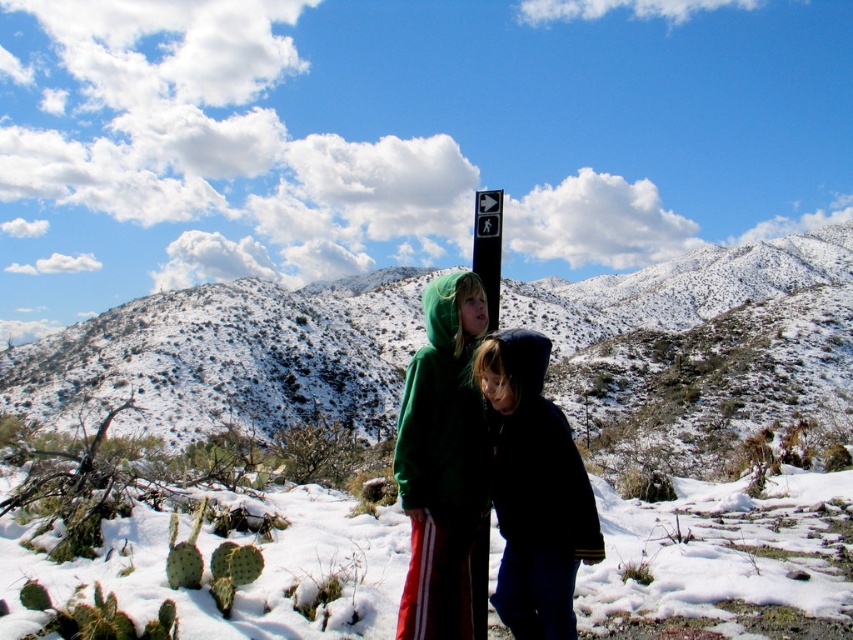
Question: Does green fleece jackets at center have a lesser width compared to black plastic sign at upper center?

Choices:
 (A) no
 (B) yes

Answer: (A)

Question: Which point appears farthest from the camera in this image?

Choices:
 (A) (602, 291)
 (B) (494, 301)
 (C) (447, 305)

Answer: (A)

Question: Which is farther from the green fleece jackets at center?

Choices:
 (A) black plastic sign at upper center
 (B) snowy rocky mountain at center

Answer: (B)

Question: Does snowy rocky mountain at center lie in front of green fleece jackets at center?

Choices:
 (A) no
 (B) yes

Answer: (A)

Question: Does snowy rocky mountain at center have a greater width compared to green fleece jackets at center?

Choices:
 (A) yes
 (B) no

Answer: (A)

Question: Estimate the real-world distances between objects in this image. Which object is closer to the black plastic sign at upper center?

Choices:
 (A) snowy rocky mountain at center
 (B) green fleece jackets at center

Answer: (B)